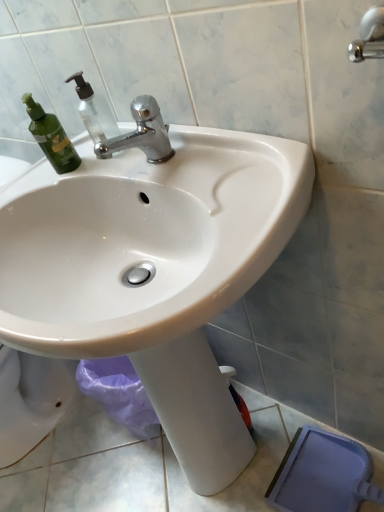
In order to click on vacant space that is to the left of transparent plastic soap dispenser at upper left in this screenshot , I will do `click(57, 172)`.